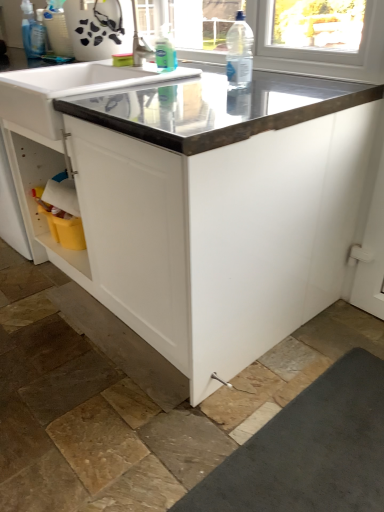
Question: Does white glossy sink at upper center lie behind clear plastic bottle at upper center?

Choices:
 (A) yes
 (B) no

Answer: (A)

Question: Is white glossy sink at upper center thinner than clear plastic bottle at upper center?

Choices:
 (A) yes
 (B) no

Answer: (B)

Question: Would you say white glossy sink at upper center is a long distance from clear plastic bottle at upper center?

Choices:
 (A) yes
 (B) no

Answer: (B)

Question: From the image's perspective, is white glossy sink at upper center beneath clear plastic bottle at upper center?

Choices:
 (A) no
 (B) yes

Answer: (B)

Question: From a real-world perspective, is white glossy sink at upper center beneath clear plastic bottle at upper center?

Choices:
 (A) yes
 (B) no

Answer: (A)

Question: Is white glossy sink at upper center surrounding clear plastic bottle at upper center?

Choices:
 (A) yes
 (B) no

Answer: (B)

Question: Does white glossy sink at upper center have a greater width compared to translucent plastic bottle at upper center, which is counted as the second cleaning product, starting from the top?

Choices:
 (A) no
 (B) yes

Answer: (B)

Question: Is white glossy sink at upper center shorter than translucent plastic bottle at upper center, marked as the 1th cleaning product in a right-to-left arrangement?

Choices:
 (A) no
 (B) yes

Answer: (A)

Question: Is white glossy sink at upper center facing away from translucent plastic bottle at upper center, marked as the first cleaning product in a front-to-back arrangement?

Choices:
 (A) no
 (B) yes

Answer: (A)

Question: Can you confirm if white glossy sink at upper center is taller than translucent plastic bottle at upper center, marked as the first cleaning product in a front-to-back arrangement?

Choices:
 (A) yes
 (B) no

Answer: (A)

Question: Would you say white glossy sink at upper center contains translucent plastic bottle at upper center, the 2th cleaning product in the back-to-front sequence?

Choices:
 (A) no
 (B) yes

Answer: (A)

Question: Is white glossy sink at upper center to the right of translucent plastic bottle at upper center, which is counted as the second cleaning product, starting from the top, from the viewer's perspective?

Choices:
 (A) yes
 (B) no

Answer: (B)

Question: Considering the relative sizes of clear plastic bottle at upper center and metallic gray countertop at center in the image provided, is clear plastic bottle at upper center wider than metallic gray countertop at center?

Choices:
 (A) yes
 (B) no

Answer: (B)